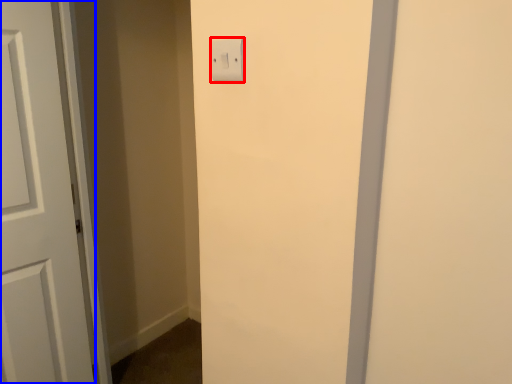
Question: Which point is further to the camera, light switch (highlighted by a red box) or door (highlighted by a blue box)?

Choices:
 (A) light switch
 (B) door

Answer: (B)